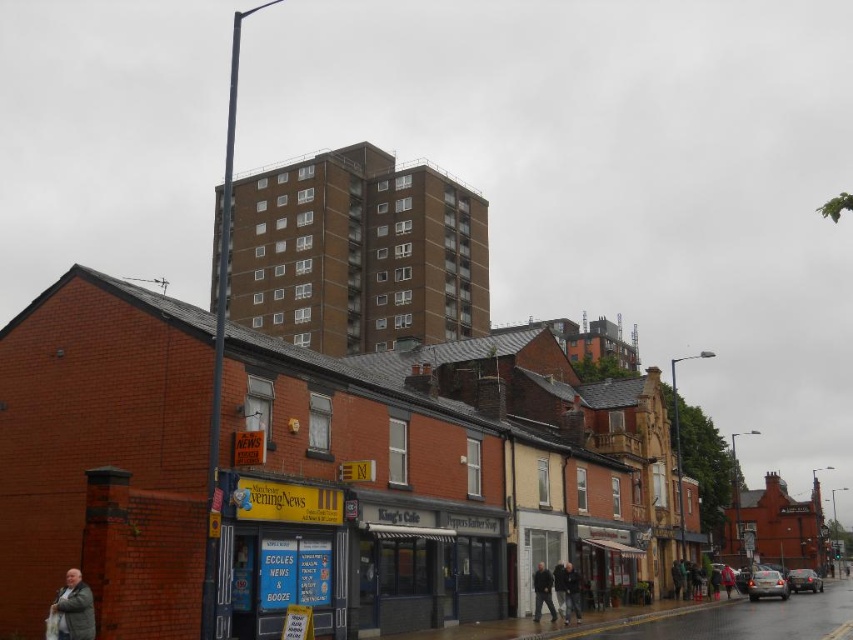
Question: Which object is positioned closest to the dark gray jacket at lower center?

Choices:
 (A) dark gray jacket at center
 (B) gray wool coat at lower left

Answer: (A)

Question: Is gray wool coat at lower left to the right of dark gray jacket at center from the viewer's perspective?

Choices:
 (A) no
 (B) yes

Answer: (A)

Question: Does gray wool coat at lower left appear on the right side of dark gray jacket at lower center?

Choices:
 (A) yes
 (B) no

Answer: (B)

Question: Among these points, which one is nearest to the camera?

Choices:
 (A) (546, 602)
 (B) (573, 573)

Answer: (A)

Question: Which point is farther to the camera?

Choices:
 (A) (555, 620)
 (B) (577, 579)
 (C) (64, 588)

Answer: (B)

Question: From the image, what is the correct spatial relationship of gray wool coat at lower left in relation to dark gray jacket at lower center?

Choices:
 (A) left
 (B) right

Answer: (A)